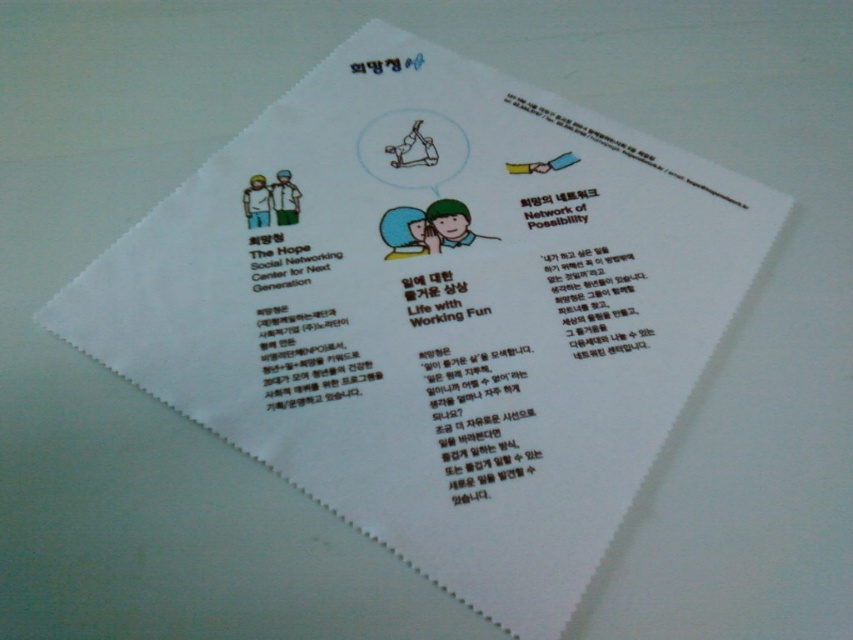
Does black matte paper at center have a smaller size compared to black paper network of possibility at upper center?

No, black matte paper at center is not smaller than black paper network of possibility at upper center.

Which is in front, point (291, 397) or point (584, 198)?

Point (291, 397) is more forward.

Where is `black matte paper at center`? The width and height of the screenshot is (853, 640). black matte paper at center is located at coordinates (306, 356).

Can you confirm if black matte paper at center is taller than black matte text at upper center?

Correct, black matte paper at center is much taller as black matte text at upper center.

Is black matte paper at center thinner than black matte text at upper center?

No, black matte paper at center is not thinner than black matte text at upper center.

Locate an element on the screen. black matte paper at center is located at coordinates (306, 356).

Is black matte text at upper center to the right of white paper at upper right from the viewer's perspective?

In fact, black matte text at upper center is to the left of white paper at upper right.

Does point (572, 346) come in front of point (547, 116)?

Yes, point (572, 346) is in front of point (547, 116).

Is point (585, 291) farther from camera compared to point (670, 173)?

That is False.

The width and height of the screenshot is (853, 640). In order to click on black matte text at upper center in this screenshot , I will do `click(596, 300)`.